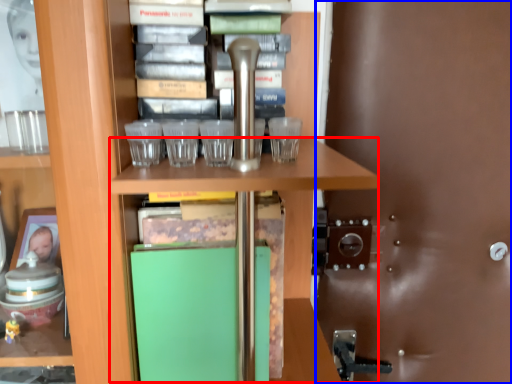
Question: Which point is closer to the camera, table (highlighted by a red box) or glass door (highlighted by a blue box)?

Choices:
 (A) table
 (B) glass door

Answer: (A)